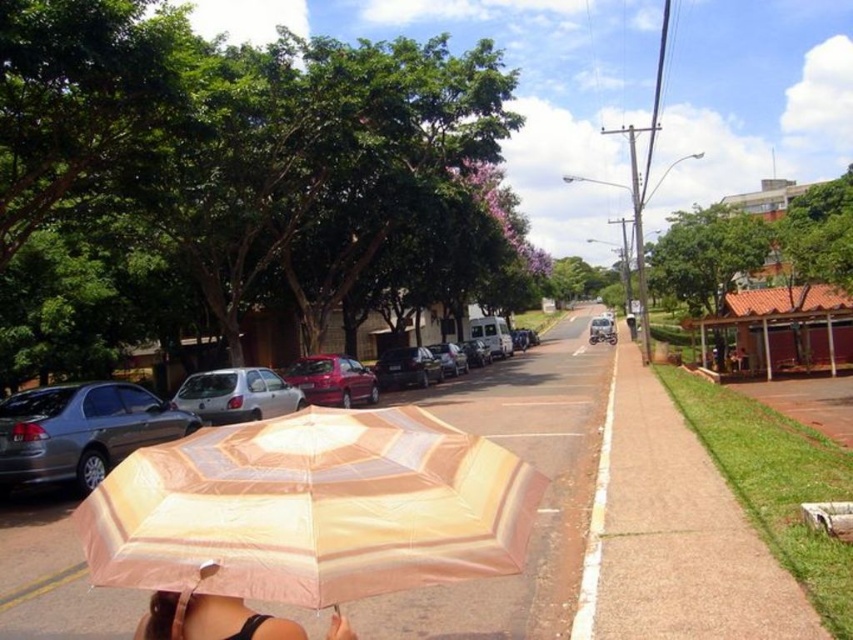
You are a delivery person trying to navigate through the street while holding the beige striped umbrella at center. There is a shiny black car at center parked in your path. Can you pass between the umbrella and the car without the umbrella touching the car?

The beige striped umbrella at center has a larger width than the shiny black car at center. Since the umbrella is wider, it would require more space to maneuver around the car, making it difficult to pass between them without the umbrella touching the car.

You are a delivery person trying to park your motorcycle between the matte gray sedan at left and the silver metallic van at center. Can your motorcycle, which is 1.2 meters wide, fit in the space between them?

The matte gray sedan at left is thinner than the silver metallic van at center, so the space between them is wider than the sedan. Since the motorcycle is 1.2 meters wide, it can fit if the space between the two vehicles is at least 1.2 meters. However, without knowing the exact width of the sedan or the van, we cannot definitively confirm if the motorcycle will fit. Please measure the space before attempting to park.

You are standing on the sidewalk and see the matte gray sedan at left and the silver metallic van at center. Which vehicle is nearer to you?

The matte gray sedan at left is closer to the viewer than the silver metallic van at center, so the matte gray sedan at left is nearer to you.